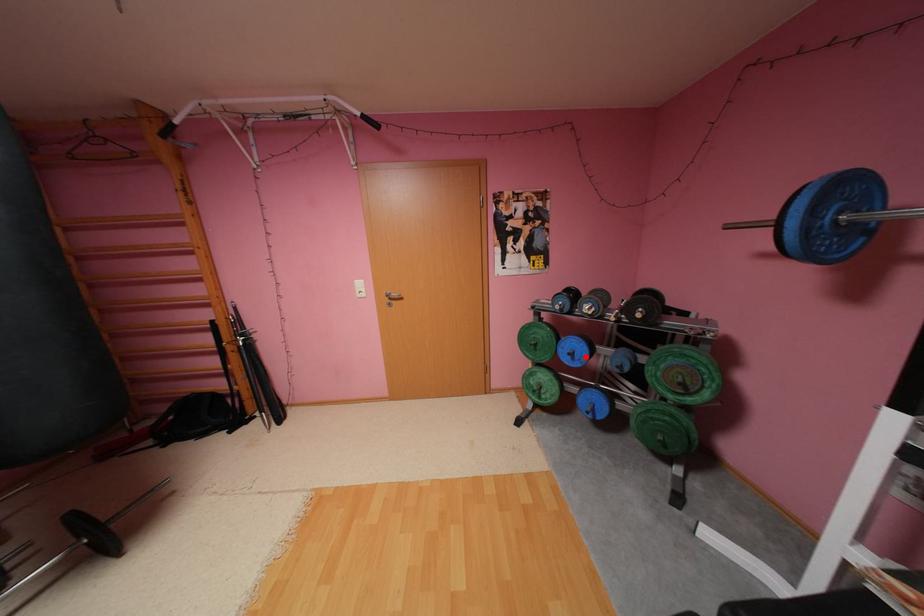
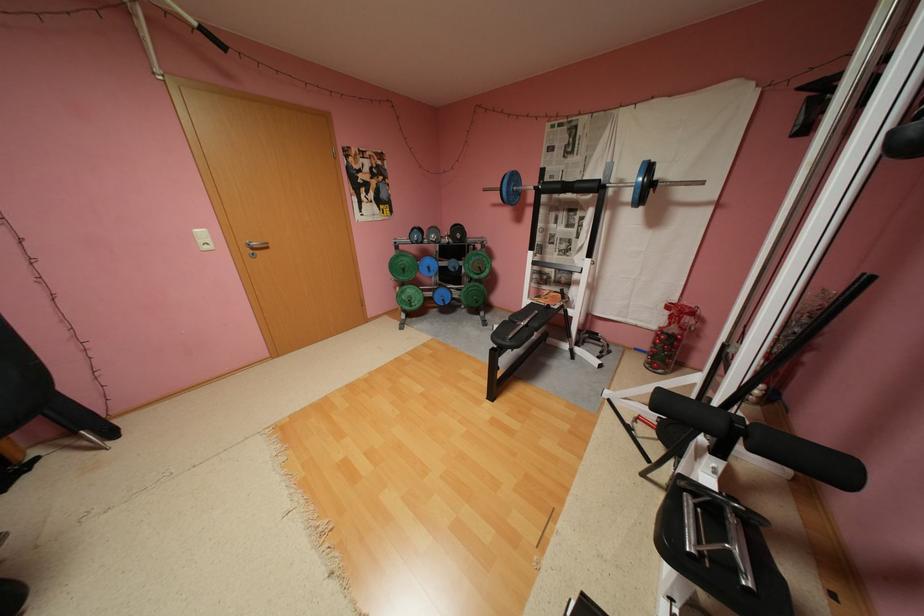
In the second image, find the point that corresponds to the highlighted location in the first image.

(441, 269)